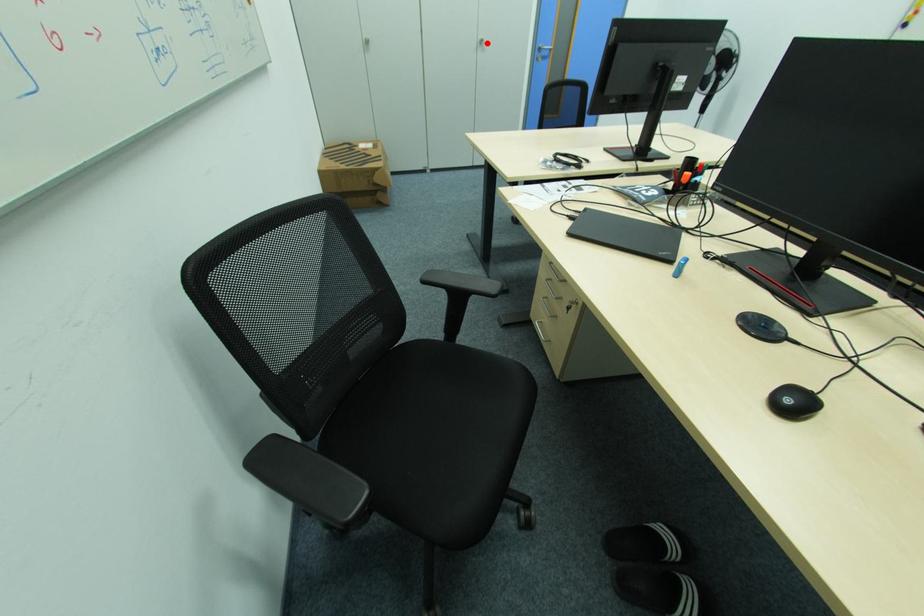
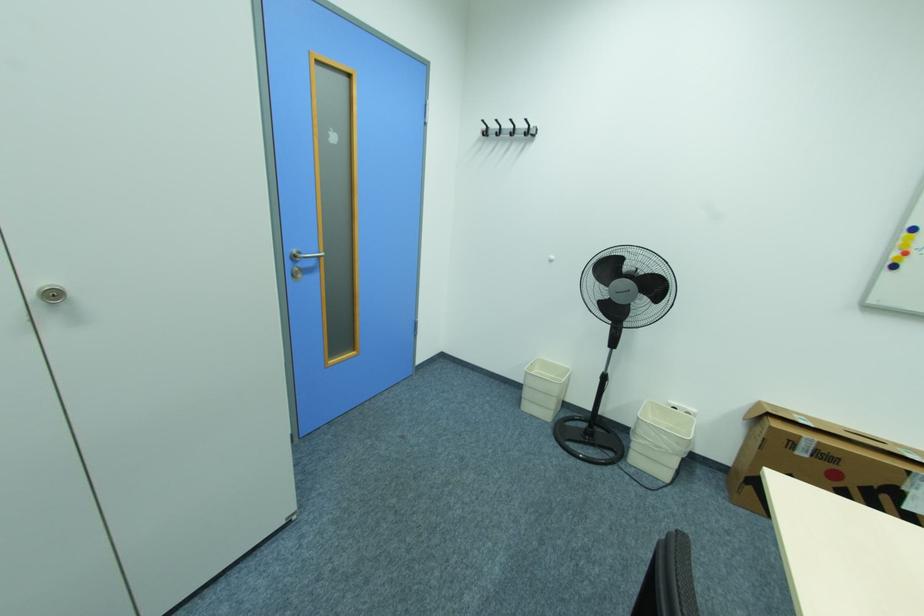
Question: I am providing you with two images of the same scene from different viewpoints. A red point is marked on the first image. Is the red point's position out of view in image 2?

Choices:
 (A) Yes
 (B) No

Answer: (B)